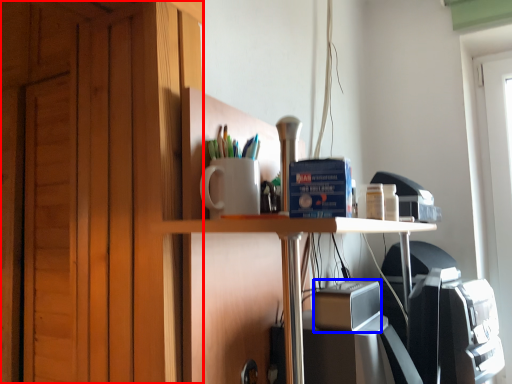
Question: Which point is further to the camera, dresser (highlighted by a red box) or appliance (highlighted by a blue box)?

Choices:
 (A) dresser
 (B) appliance

Answer: (A)